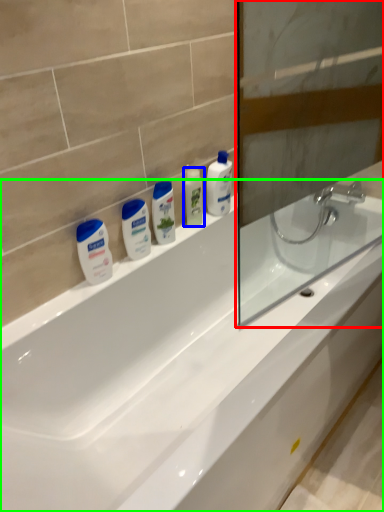
Question: Based on their relative distances, which object is farther from screen door (highlighted by a red box)? Choose from mouthwash (highlighted by a blue box) and bathtub (highlighted by a green box).

Choices:
 (A) mouthwash
 (B) bathtub

Answer: (A)